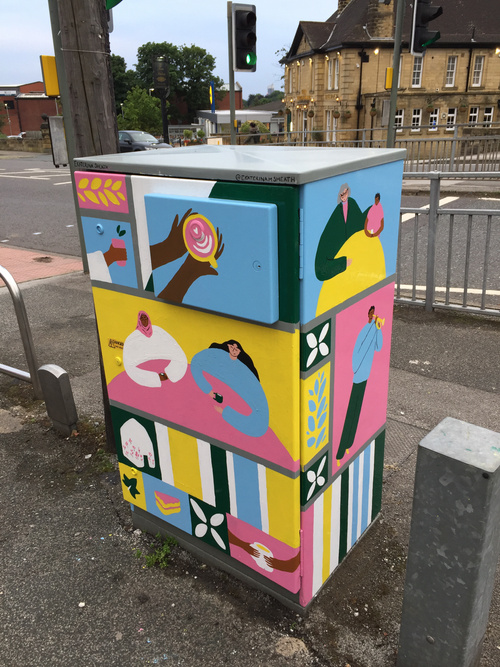
The width and height of the screenshot is (500, 667). Find the location of `vertical grey piller`. vertical grey piller is located at coordinates (447, 566).